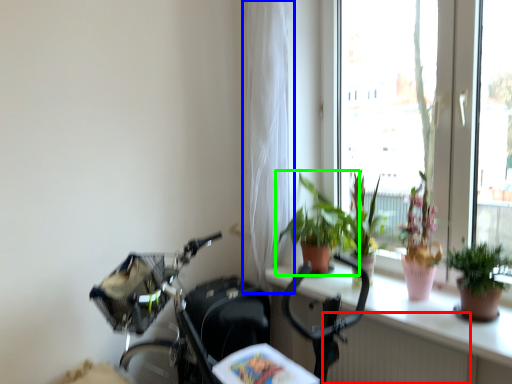
Question: Based on their relative distances, which object is nearer to radiator (highlighted by a red box)? Choose from curtain (highlighted by a blue box) and houseplant (highlighted by a green box).

Choices:
 (A) curtain
 (B) houseplant

Answer: (B)